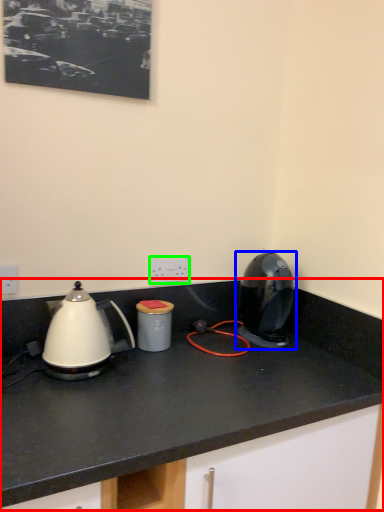
Question: Estimate the real-world distances between objects in this image. Which object is farther from countertop (highlighted by a red box), home appliance (highlighted by a blue box) or electric outlet (highlighted by a green box)?

Choices:
 (A) home appliance
 (B) electric outlet

Answer: (B)